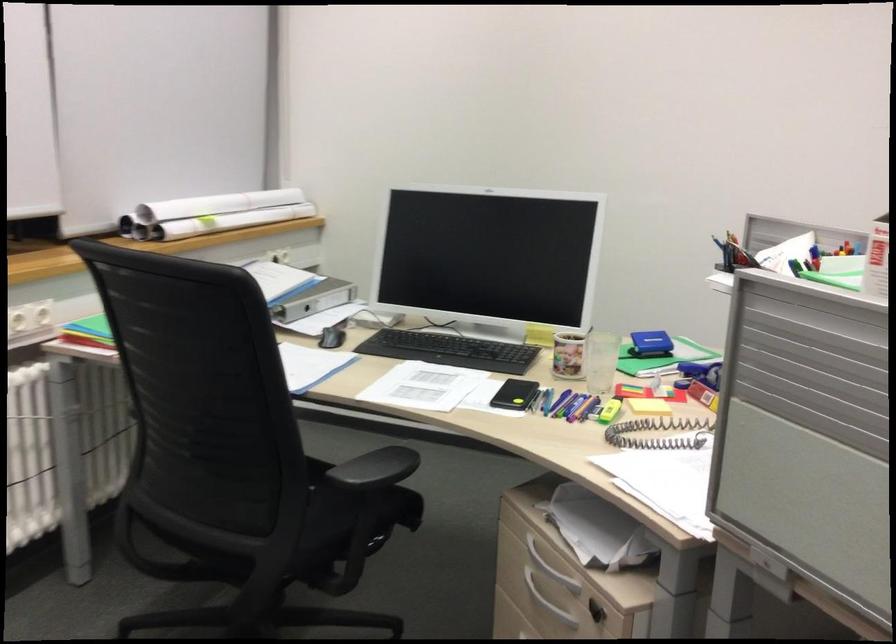
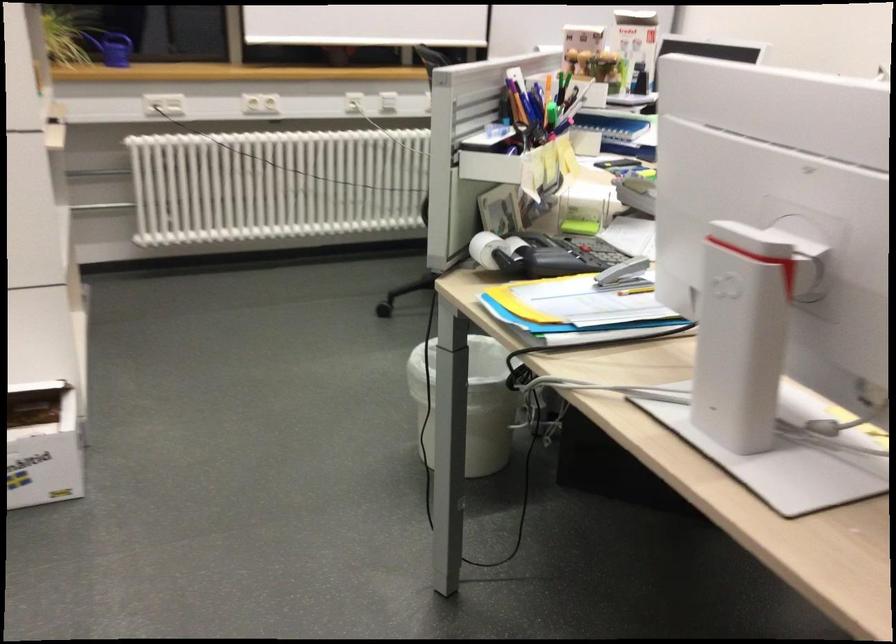
Question: I am providing you with two images of the same scene from different viewpoints. After the viewpoint changes to image2, which objects are now occluded?

Choices:
 (A) silver shower handle
 (B) grey ring binder
 (C) red pen
 (D) grey stapler

Answer: (B)